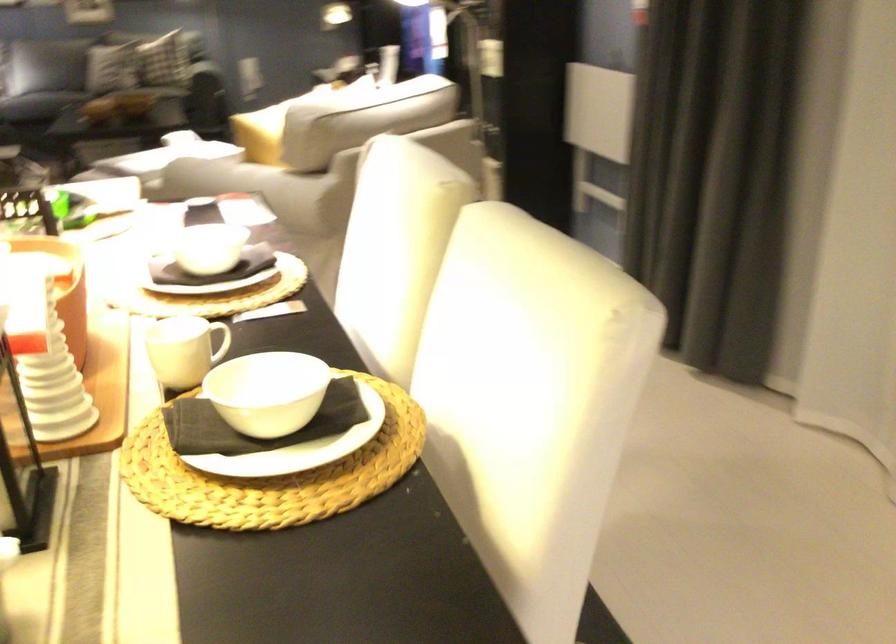
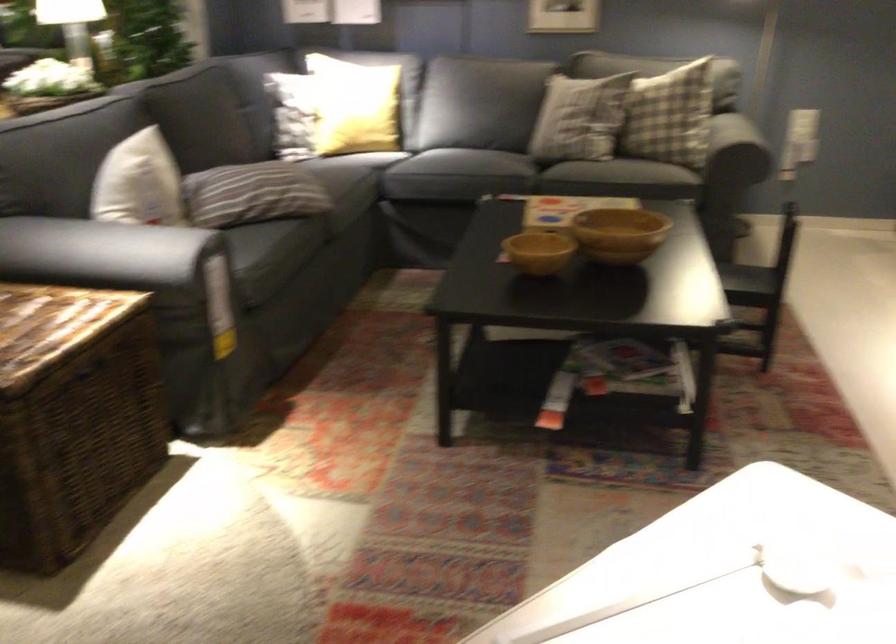
Find the pixel in the second image that matches (136,93) in the first image.

(618, 234)